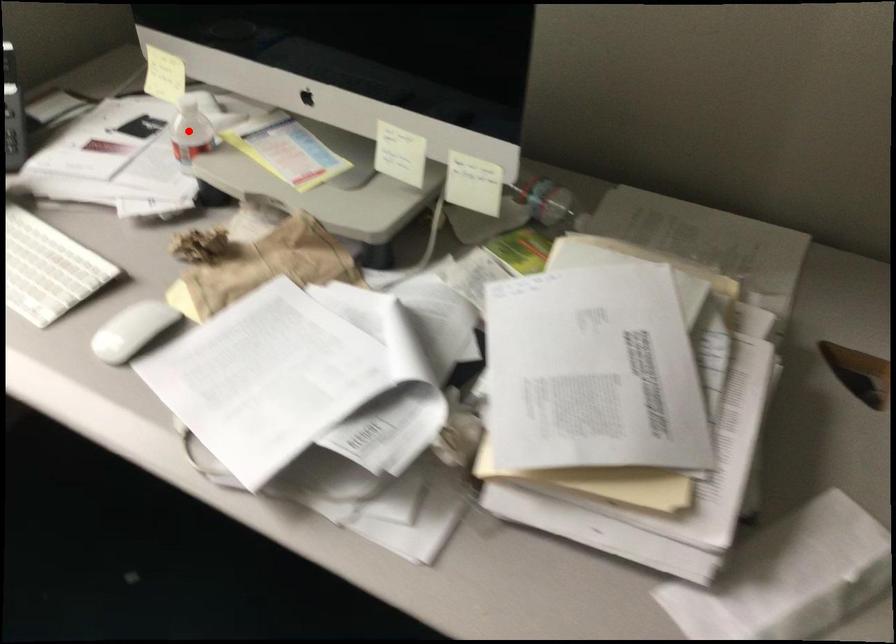
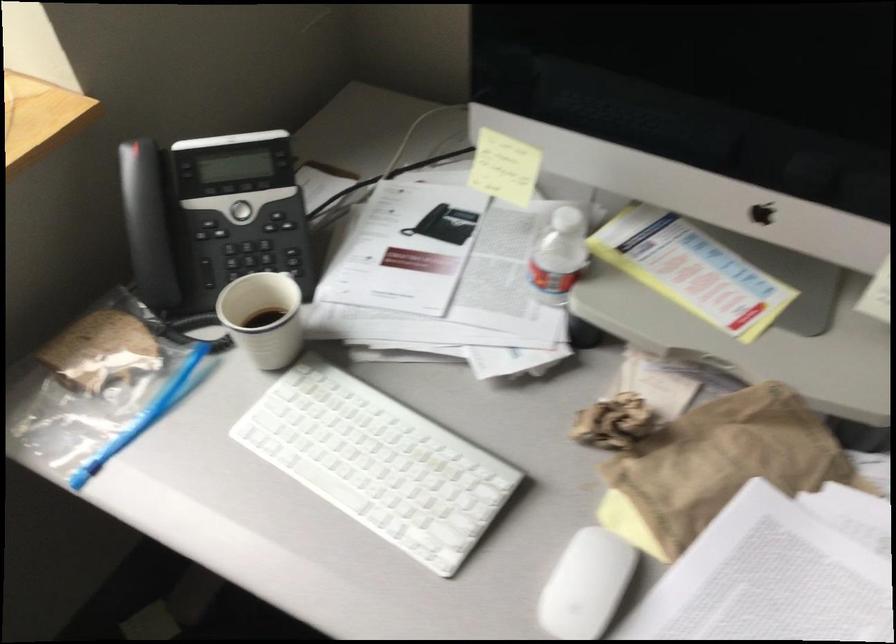
In the second image, find the point that corresponds to the highlighted location in the first image.

(558, 254)